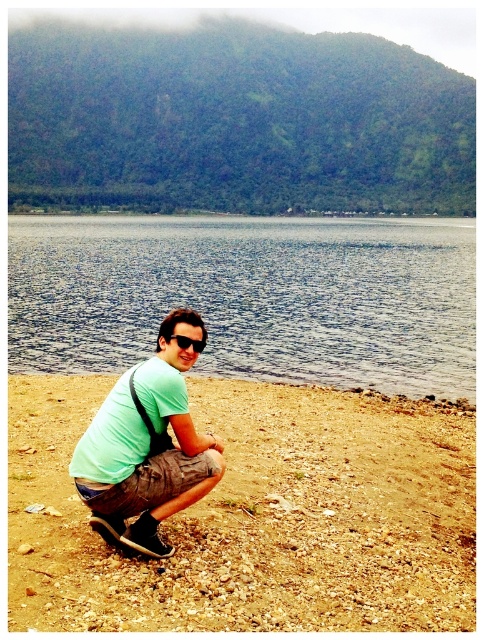
You are a photographer standing at the edge of the shoreline. You want to capture a photo of the green matte shirt at center while ensuring the brown gravelly sand at lower center is visible in the foreground. Is the distance between them sufficient to include both in a single frame without moving closer or farther?

The distance between the brown gravelly sand at lower center and the green matte shirt at center is 3.57 meters. Depending on the camera lens used, this distance may require a wide angle to capture both in one frame without moving.

You are a photographer trying to capture the green matte shirt at center in the image. What are the coordinates where you should focus your camera?

The coordinates to focus on are (147, 445).